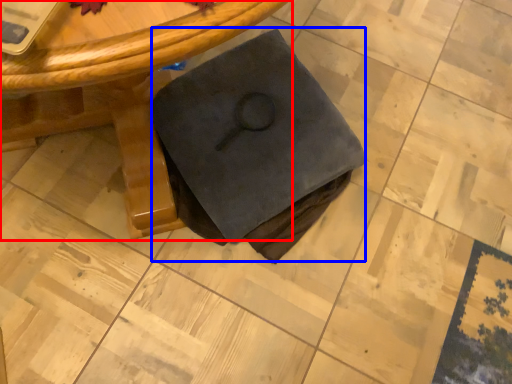
Question: Which object appears closest to the camera in this image, table (highlighted by a red box) or fabric (highlighted by a blue box)?

Choices:
 (A) table
 (B) fabric

Answer: (A)